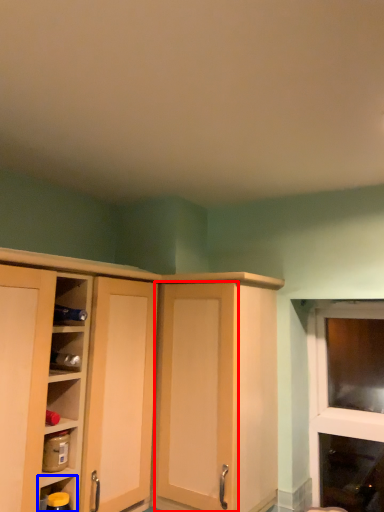
Question: Which object appears farthest to the camera in this image, screen door (highlighted by a red box) or shelf (highlighted by a blue box)?

Choices:
 (A) screen door
 (B) shelf

Answer: (A)